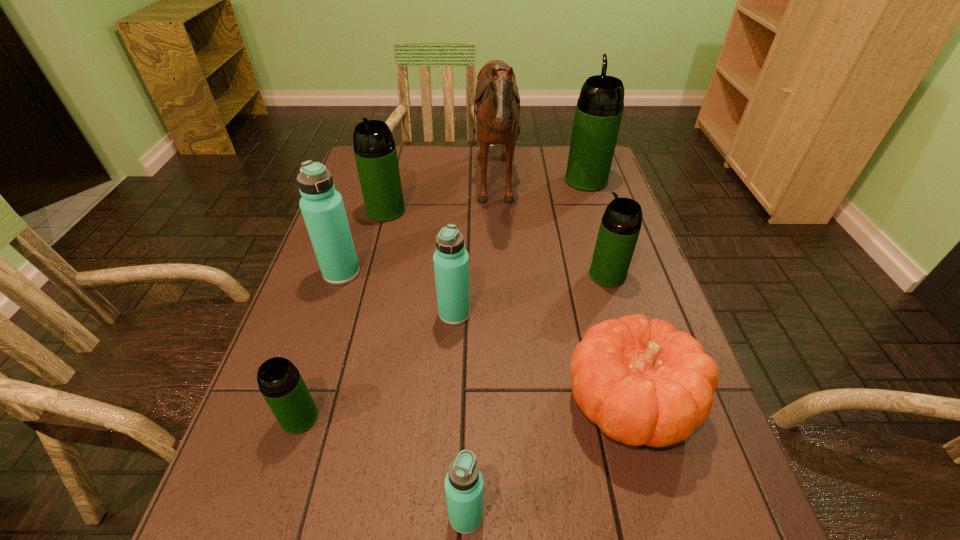
Identify the location of the second closest green thermos bottle relative to the sixth farthest thermos bottle. The height and width of the screenshot is (540, 960). (620, 226).

Identify which green thermos bottle is the second nearest to the orange pumpkin. Please provide its 2D coordinates. Your answer should be formatted as a tuple, i.e. [(x, y)], where the tuple contains the x and y coordinates of a point satisfying the conditions above.

[(281, 384)]

Identify which aqua thermos bottle is the nearest to the pumpkin. Please provide its 2D coordinates. Your answer should be formatted as a tuple, i.e. [(x, y)], where the tuple contains the x and y coordinates of a point satisfying the conditions above.

[(463, 483)]

What are the coordinates of `aqua thermos bottle that can be found as the third closest to the second nearest green thermos bottle` in the screenshot? It's located at (322, 207).

The height and width of the screenshot is (540, 960). Find the location of `free space that satisfies the following two spatial constraints: 1. on the back of the tallest object; 2. on the back side of the pumpkin`. free space that satisfies the following two spatial constraints: 1. on the back of the tallest object; 2. on the back side of the pumpkin is located at coordinates (505, 403).

I want to click on free space that satisfies the following two spatial constraints: 1. from the spout of the second biggest green thermos bottle; 2. on the left side of the second farthest aqua thermos bottle, so click(x=359, y=314).

Find the location of a particular element. The height and width of the screenshot is (540, 960). free region that satisfies the following two spatial constraints: 1. from the spout of the second nearest green thermos bottle; 2. from the spout of the nearest green thermos bottle is located at coordinates (650, 417).

Locate an element on the screen. vacant space that satisfies the following two spatial constraints: 1. from the spout of the fourth nearest object; 2. on the left side of the second farthest thermos bottle is located at coordinates (359, 314).

Where is `vacant space that satisfies the following two spatial constraints: 1. from the spout of the pumpkin; 2. on the right side of the sixth nearest thermos bottle`? vacant space that satisfies the following two spatial constraints: 1. from the spout of the pumpkin; 2. on the right side of the sixth nearest thermos bottle is located at coordinates point(335,403).